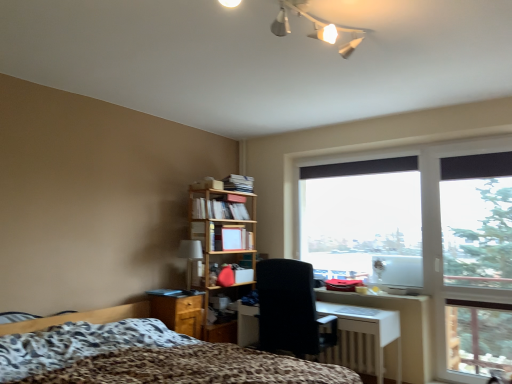
Question: From the image's perspective, is matte wooden bookshelf at center located beneath white glossy desk at center?

Choices:
 (A) yes
 (B) no

Answer: (B)

Question: Can you confirm if matte wooden bookshelf at center is bigger than white glossy desk at center?

Choices:
 (A) yes
 (B) no

Answer: (B)

Question: From the image's perspective, is matte wooden bookshelf at center over white glossy desk at center?

Choices:
 (A) yes
 (B) no

Answer: (A)

Question: Is matte wooden bookshelf at center further to camera compared to white glossy desk at center?

Choices:
 (A) yes
 (B) no

Answer: (A)

Question: Does matte wooden bookshelf at center have a lesser height compared to white glossy desk at center?

Choices:
 (A) yes
 (B) no

Answer: (A)

Question: Is matte wooden bookshelf at center located outside white glossy desk at center?

Choices:
 (A) no
 (B) yes

Answer: (B)

Question: From the image's perspective, is leopard print fabric bed at lower left on top of black fabric chair at center?

Choices:
 (A) no
 (B) yes

Answer: (A)

Question: Would you say leopard print fabric bed at lower left is outside black fabric chair at center?

Choices:
 (A) yes
 (B) no

Answer: (A)

Question: Does leopard print fabric bed at lower left have a smaller size compared to black fabric chair at center?

Choices:
 (A) no
 (B) yes

Answer: (A)

Question: Does leopard print fabric bed at lower left lie behind black fabric chair at center?

Choices:
 (A) no
 (B) yes

Answer: (A)

Question: Is leopard print fabric bed at lower left in contact with black fabric chair at center?

Choices:
 (A) no
 (B) yes

Answer: (A)

Question: From the image's perspective, is leopard print fabric bed at lower left under black fabric chair at center?

Choices:
 (A) no
 (B) yes

Answer: (B)

Question: Considering the relative positions of matte wooden bookshelf at center and leopard print fabric bed at lower left in the image provided, is matte wooden bookshelf at center to the right of leopard print fabric bed at lower left from the viewer's perspective?

Choices:
 (A) yes
 (B) no

Answer: (A)